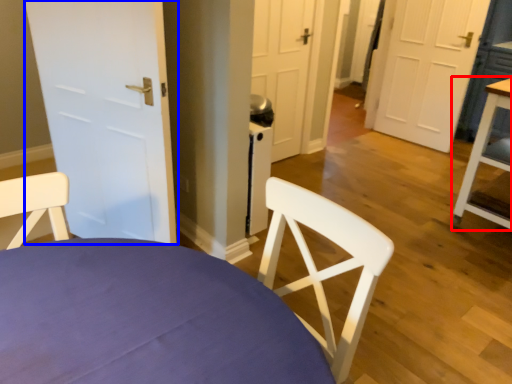
Question: Among these objects, which one is farthest to the camera, table (highlighted by a red box) or door (highlighted by a blue box)?

Choices:
 (A) table
 (B) door

Answer: (A)